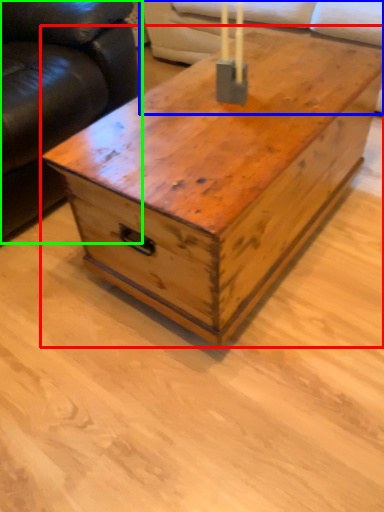
Question: Considering the real-world distances, which object is closest to table (highlighted by a red box)? couch (highlighted by a blue box) or studio couch (highlighted by a green box).

Choices:
 (A) couch
 (B) studio couch

Answer: (B)